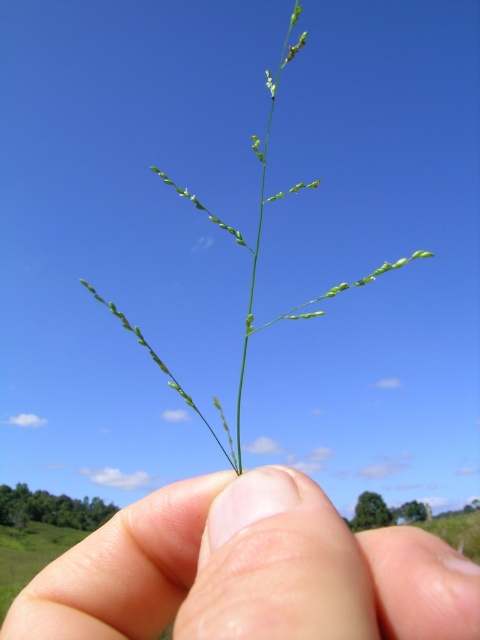
Which is below, smooth skin at center or green leafy plant at center?

smooth skin at center is below.

Locate an element on the screen. The height and width of the screenshot is (640, 480). smooth skin at center is located at coordinates (249, 572).

This screenshot has width=480, height=640. Find the location of `smooth skin at center`. smooth skin at center is located at coordinates (249, 572).